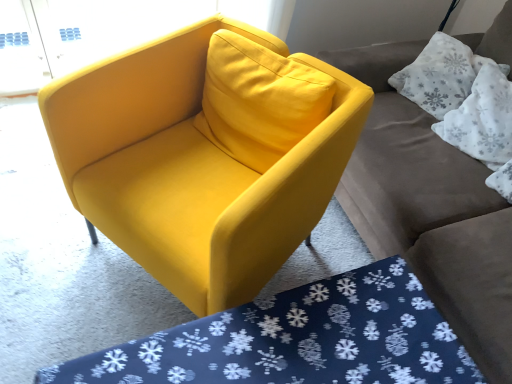
You are a GUI agent. You are given a task and a screenshot of the screen. Output one action in this format:
    pyautogui.click(x=<x>, y=<y>)
    Task: Click on the vacant space situated above blue snowflake-patterned mat at lower center (from a real-world perspective)
    The width and height of the screenshot is (512, 384).
    Given the screenshot: What is the action you would take?
    pyautogui.click(x=307, y=333)